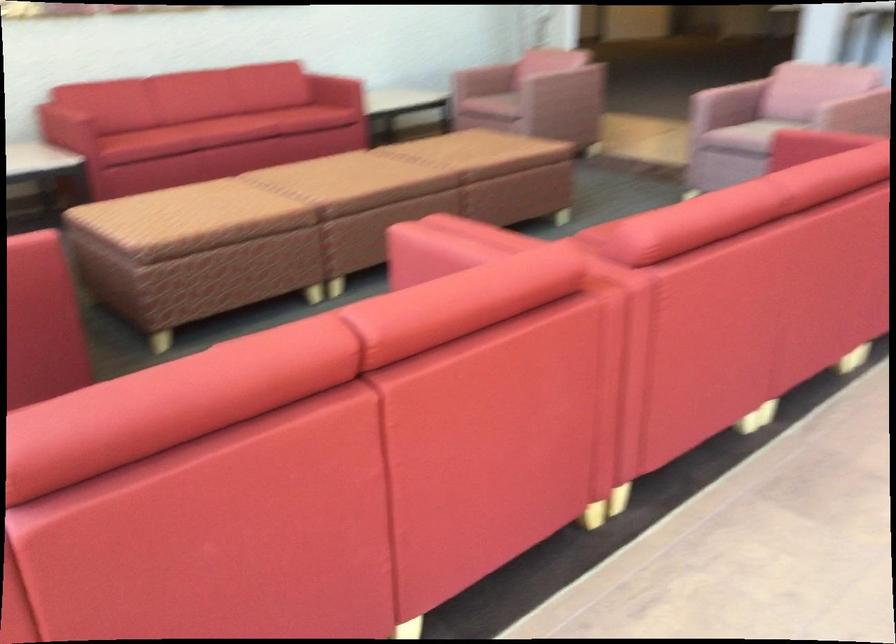
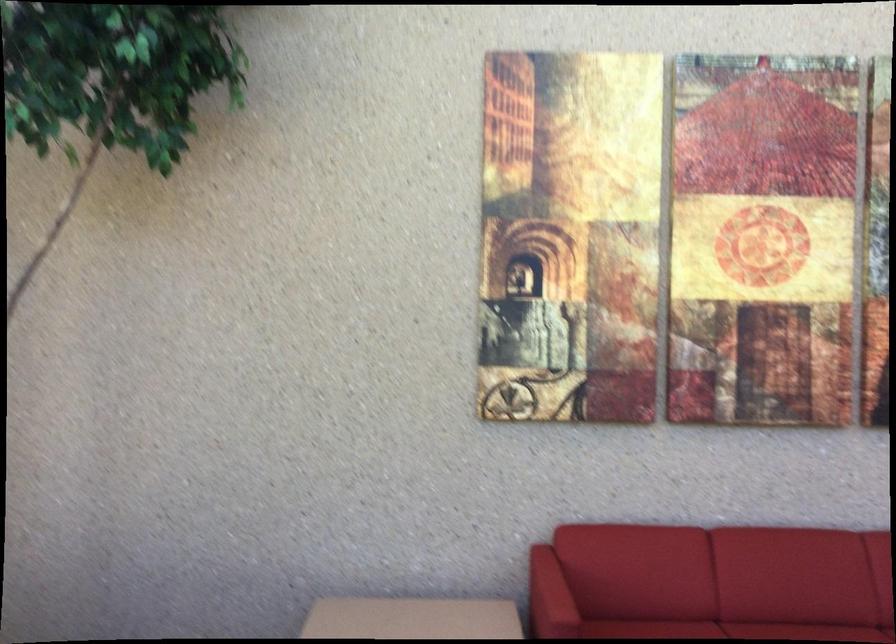
Find the pixel in the second image that matches pixel 73 111 in the first image.

(549, 597)